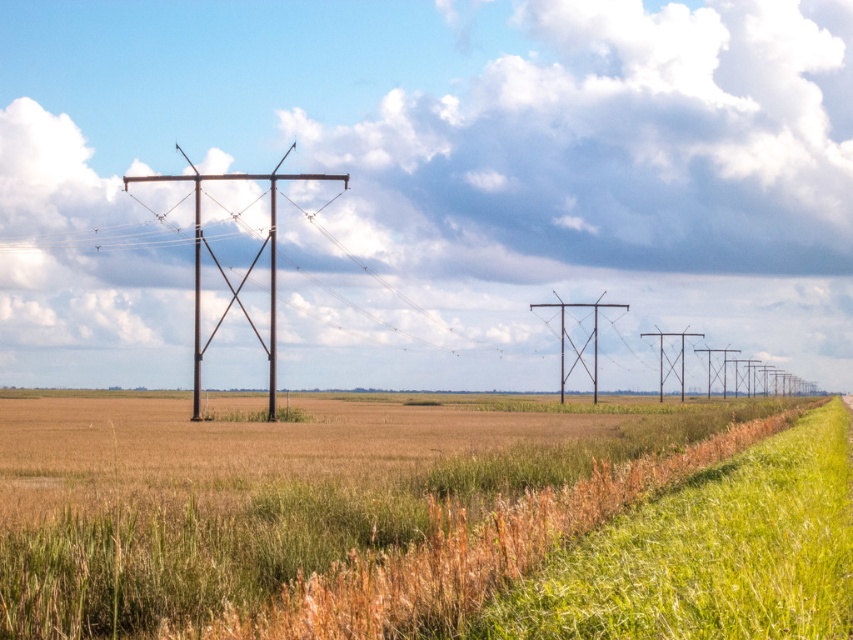
You are a maintenance worker assessing the field. You need to replace the narrower pole between the rusty metal telegraph pole at left and the rusty metal telegraph pole at center. Which pole should you replace?

The rusty metal telegraph pole at center should be replaced because the rusty metal telegraph pole at left might be wider than it, so the center pole is narrower.

You are a farmer checking the health of your crops. You notice the brown grassy wheat field at center and the rusty metal telegraph pole at center. Which object takes up more space in the image?

The brown grassy wheat field at center takes up more space in the image as it is larger in size than the rusty metal telegraph pole at center.

You are standing at the origin point of the image coordinate system. You want to walk to the brown grassy wheat field at center. Which direction should you move in terms of x and y coordinates?

The brown grassy wheat field at center is located at coordinates point 0.777 on the x axis and 0.319 on the y axis, so you should move towards the right and forward in the image to reach it.